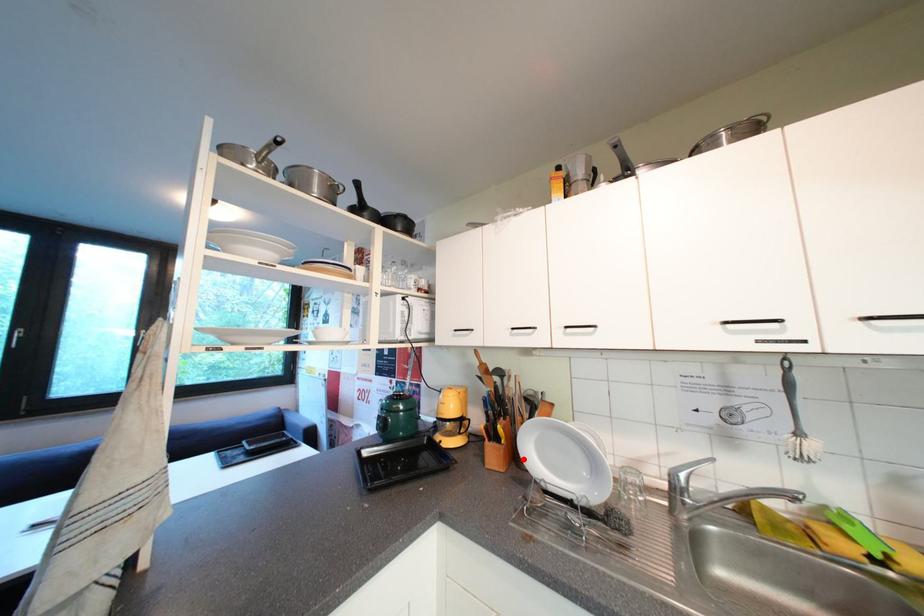
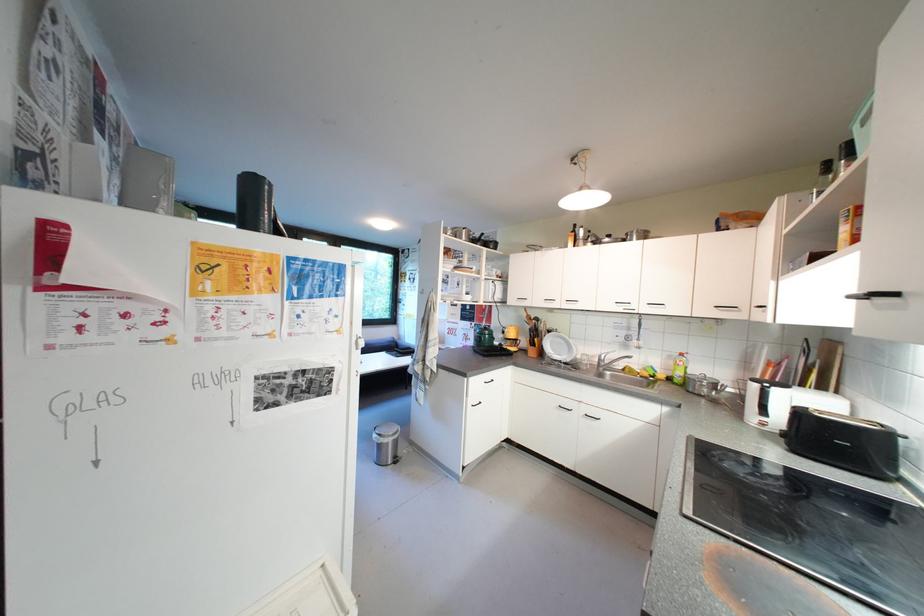
Where in the second image is the point corresponding to the highlighted location from the first image?

(550, 355)